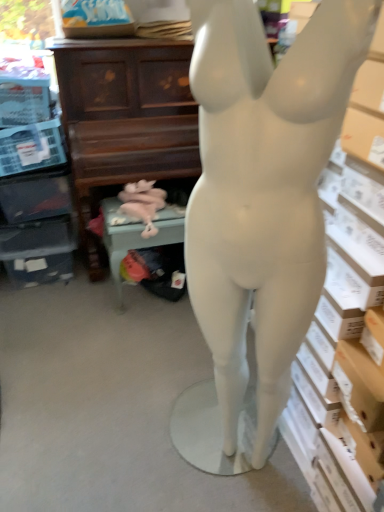
Locate an element on the screen. The height and width of the screenshot is (512, 384). free space that is to the left of matte white mannequin at center is located at coordinates (147, 454).